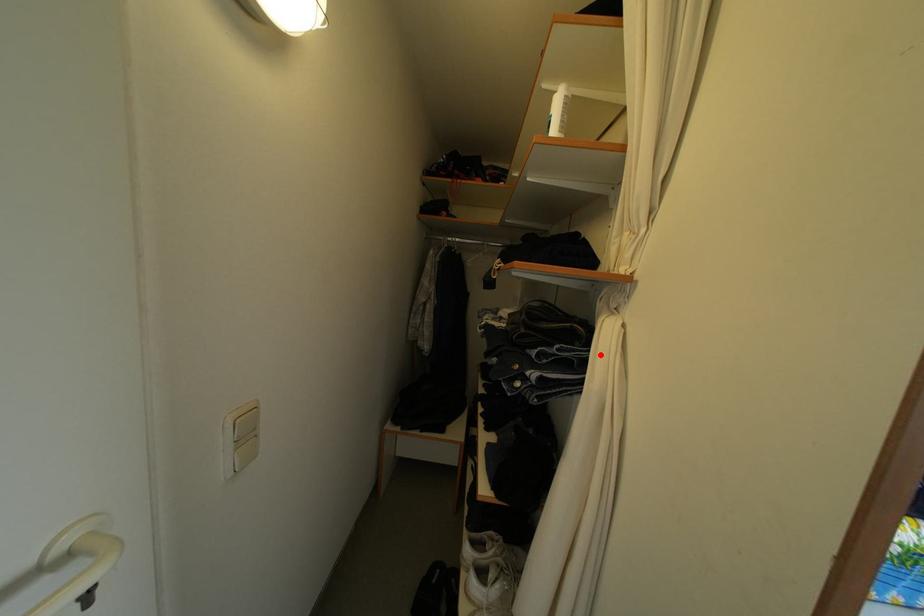
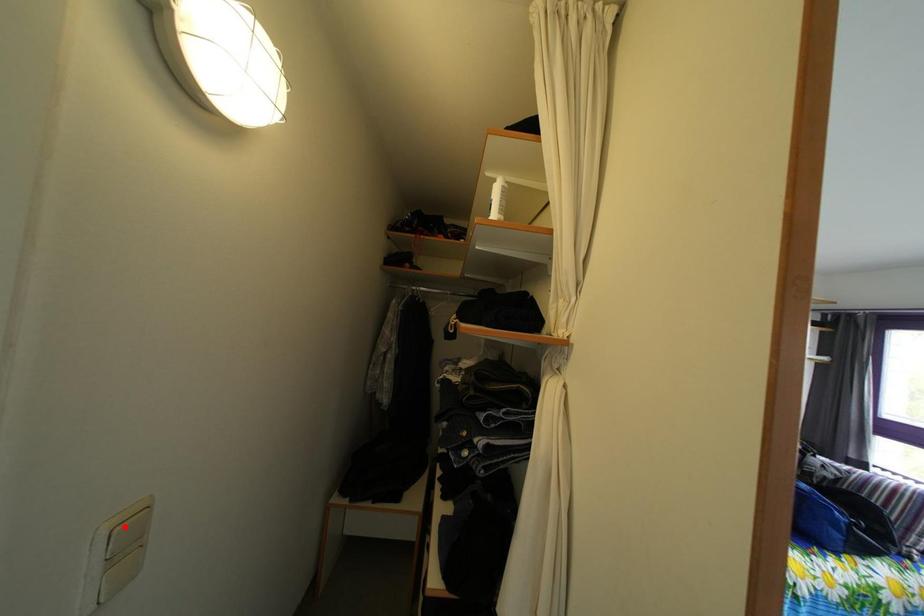
I am providing you with two images of the same scene from different viewpoints. A red point is marked on the first image and another point is marked on the second image. Are the points marked in image1 and image2 representing the same 3D position?

No